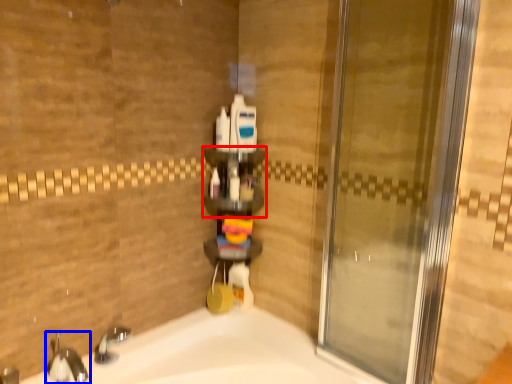
Question: Which object appears closest to the camera in this image, shelf (highlighted by a red box) or tap (highlighted by a blue box)?

Choices:
 (A) shelf
 (B) tap

Answer: (B)